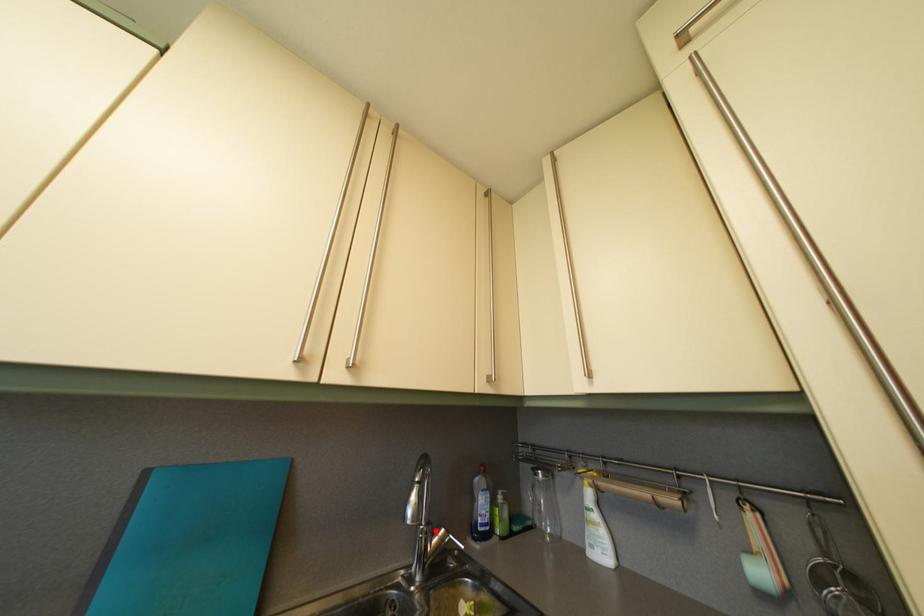
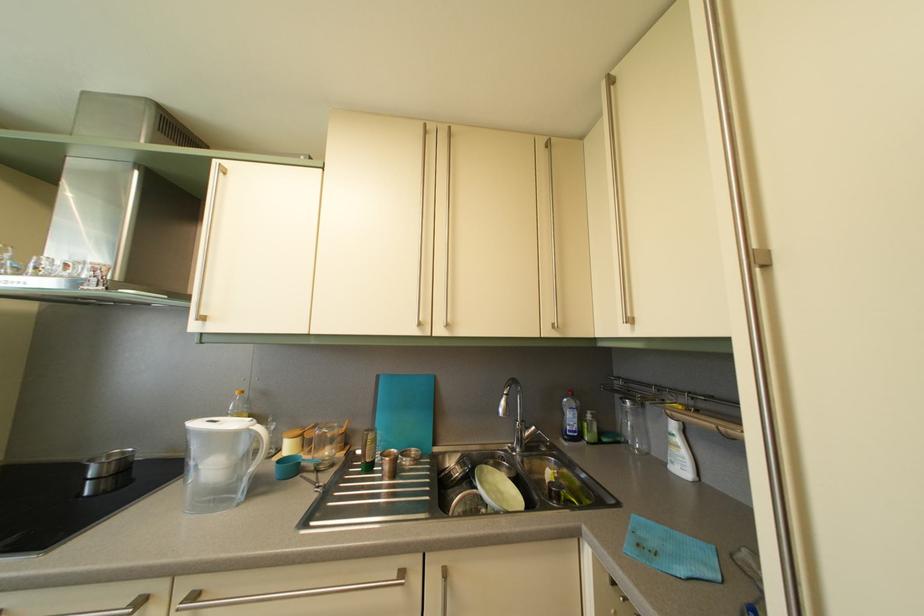
Where in the second image is the point corresponding to the highlighted location from the first image?

(530, 429)